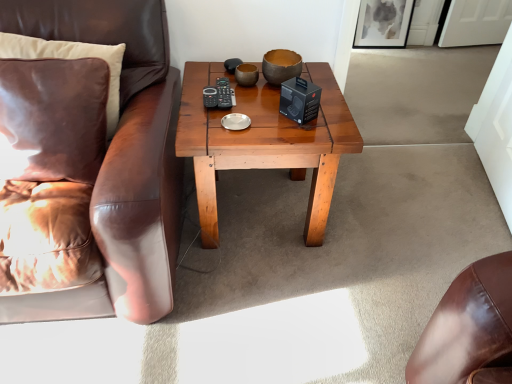
Identify the location of vacant space underneath wooden coffee table at center (from a real-world perspective). (263, 211).